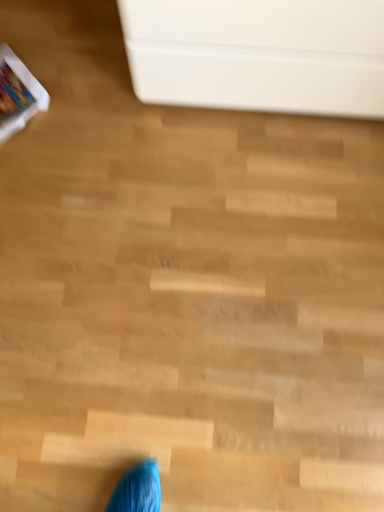
Locate an element on the screen. The width and height of the screenshot is (384, 512). white glossy dishwasher at upper center is located at coordinates [x=258, y=54].

The height and width of the screenshot is (512, 384). What do you see at coordinates (258, 54) in the screenshot?
I see `white glossy dishwasher at upper center` at bounding box center [258, 54].

Locate an element on the screen. white glossy dishwasher at upper center is located at coordinates (258, 54).